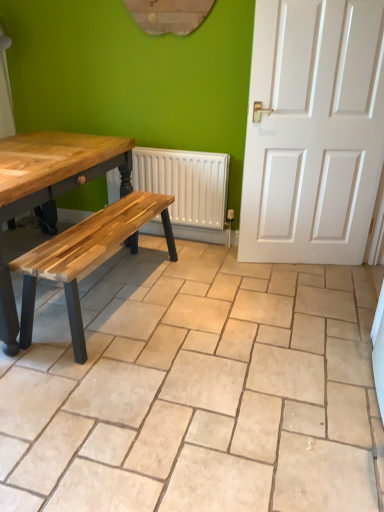
Question: Is white textured radiator at center thinner than beige ceramic tile at center?

Choices:
 (A) no
 (B) yes

Answer: (B)

Question: Considering the relative positions of white textured radiator at center and beige ceramic tile at center in the image provided, is white textured radiator at center to the left of beige ceramic tile at center from the viewer's perspective?

Choices:
 (A) yes
 (B) no

Answer: (B)

Question: Are white textured radiator at center and beige ceramic tile at center beside each other?

Choices:
 (A) no
 (B) yes

Answer: (A)

Question: Considering the relative sizes of white textured radiator at center and beige ceramic tile at center in the image provided, is white textured radiator at center smaller than beige ceramic tile at center?

Choices:
 (A) no
 (B) yes

Answer: (B)

Question: From a real-world perspective, is white textured radiator at center positioned over beige ceramic tile at center based on gravity?

Choices:
 (A) yes
 (B) no

Answer: (A)

Question: Could you tell me if white textured radiator at center is facing beige ceramic tile at center?

Choices:
 (A) yes
 (B) no

Answer: (A)

Question: From a real-world perspective, is beige ceramic tile at center over white textured radiator at center?

Choices:
 (A) yes
 (B) no

Answer: (B)

Question: From the image's perspective, is beige ceramic tile at center beneath white textured radiator at center?

Choices:
 (A) no
 (B) yes

Answer: (B)

Question: Is beige ceramic tile at center far away from white textured radiator at center?

Choices:
 (A) yes
 (B) no

Answer: (A)

Question: Would you say beige ceramic tile at center is outside white textured radiator at center?

Choices:
 (A) yes
 (B) no

Answer: (A)

Question: Is beige ceramic tile at center oriented away from white textured radiator at center?

Choices:
 (A) no
 (B) yes

Answer: (A)

Question: Is white textured radiator at center a part of beige ceramic tile at center?

Choices:
 (A) no
 (B) yes

Answer: (A)

Question: Is point (223, 478) closer or farther from the camera than point (167, 174)?

Choices:
 (A) closer
 (B) farther

Answer: (A)